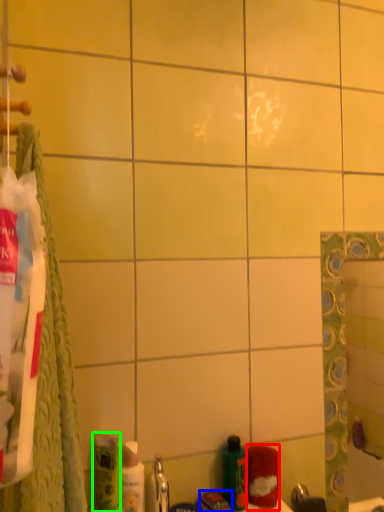
Question: Which object is positioned closest to cleaning product (highlighted by a red box)? Select from toothpaste (highlighted by a blue box) and mouthwash (highlighted by a green box).

Choices:
 (A) toothpaste
 (B) mouthwash

Answer: (A)